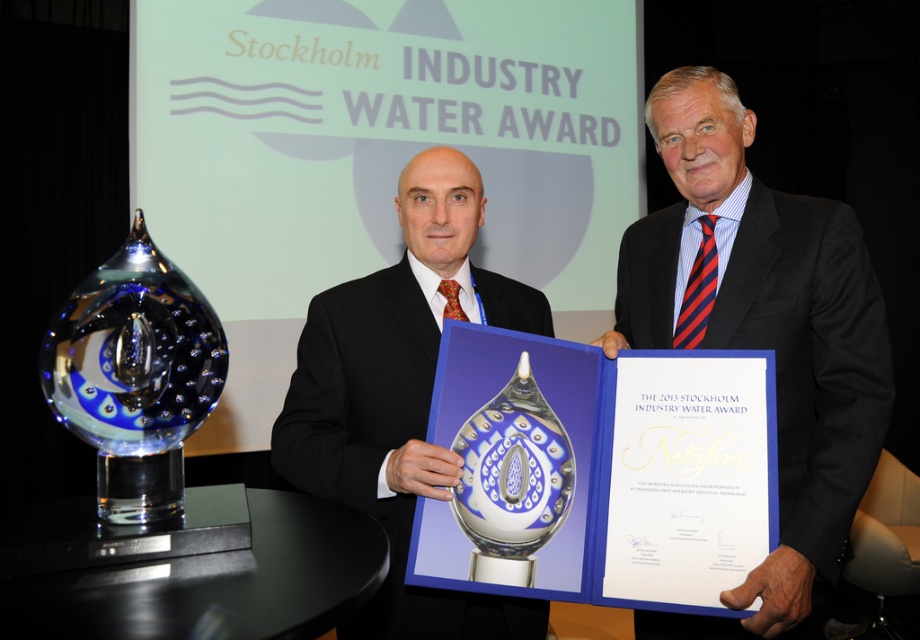
Between blue glass award at center and matte black suit at center, which one is positioned higher?

blue glass award at center

Is blue glass award at center bigger than matte black suit at center?

Yes, blue glass award at center is bigger than matte black suit at center.

Does point (785, 291) come behind point (509, 632)?

No, (785, 291) is in front of (509, 632).

In order to click on blue glass award at center in this screenshot , I will do `click(761, 333)`.

Is matte black suit at center shorter than transparent glass trophy at center?

No, matte black suit at center is not shorter than transparent glass trophy at center.

Measure the distance from matte black suit at center to transparent glass trophy at center.

They are 8.99 inches apart.

The image size is (920, 640). Identify the location of matte black suit at center. (401, 396).

Can you confirm if matte black suit at center is smaller than blue glass trophy at left?

Incorrect, matte black suit at center is not smaller in size than blue glass trophy at left.

Between matte black suit at center and blue glass trophy at left, which one is positioned higher?

blue glass trophy at left

Describe the element at coordinates (401, 396) in the screenshot. The width and height of the screenshot is (920, 640). I see `matte black suit at center` at that location.

Locate an element on the screen. The height and width of the screenshot is (640, 920). matte black suit at center is located at coordinates (401, 396).